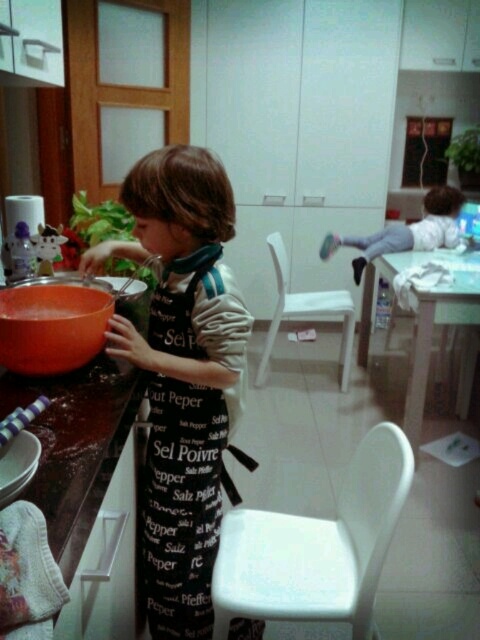
You are a parent in the kitchen and want to hang the matte black apron at left on the matte orange bowl at left. Is the bowl tall enough to support the apron?

The matte black apron at left is taller than the matte orange bowl at left, so the bowl may not provide sufficient support to hold the apron upright.

You are a parent in the kitchen and want to place a small toy on the white glossy table at lower right. Is the table currently accessible for placing the toy without moving the light gray fabric pants at center?

The white glossy table at lower right is positioned under light gray fabric pants at center, so the table is not accessible without moving the light gray fabric pants at center.